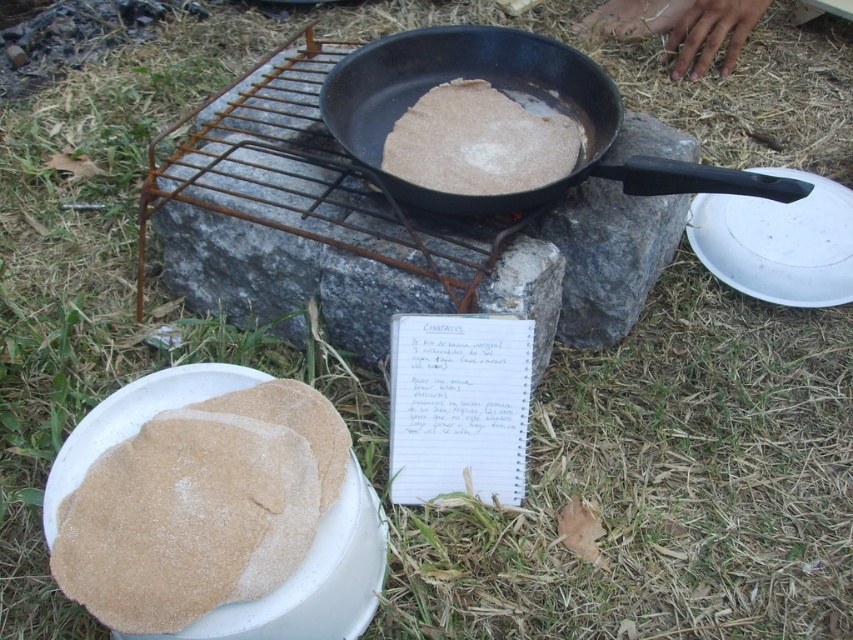
Who is more forward, (219, 397) or (363, 122)?

Point (219, 397) is more forward.

Who is more forward, (103,579) or (480,58)?

Point (103,579)

I want to click on brown matte flatbread at lower left, so click(201, 506).

Is point (195, 458) less distant than point (428, 186)?

Yes, it is.

Is brown matte flatbread at lower left to the right of brown matte flatbread at center from the viewer's perspective?

No, brown matte flatbread at lower left is not to the right of brown matte flatbread at center.

Image resolution: width=853 pixels, height=640 pixels. I want to click on brown matte flatbread at lower left, so click(x=201, y=506).

In order to click on brown matte flatbread at lower left in this screenshot , I will do `click(201, 506)`.

Which is more to the left, black non-stick frying pan at center or brown matte flatbread at center?

Positioned to the left is brown matte flatbread at center.

From the picture: Between black non-stick frying pan at center and brown matte flatbread at center, which one is positioned higher?

brown matte flatbread at center is higher up.

Between point (636, 179) and point (430, 115), which one is positioned behind?

The point (430, 115) is behind.

The width and height of the screenshot is (853, 640). What are the coordinates of `black non-stick frying pan at center` in the screenshot? It's located at (512, 99).